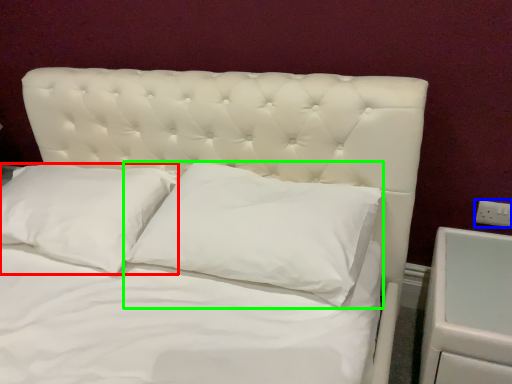
Question: Estimate the real-world distances between objects in this image. Which object is closer to pillow (highlighted by a red box), electric outlet (highlighted by a blue box) or pillow (highlighted by a green box)?

Choices:
 (A) electric outlet
 (B) pillow

Answer: (B)